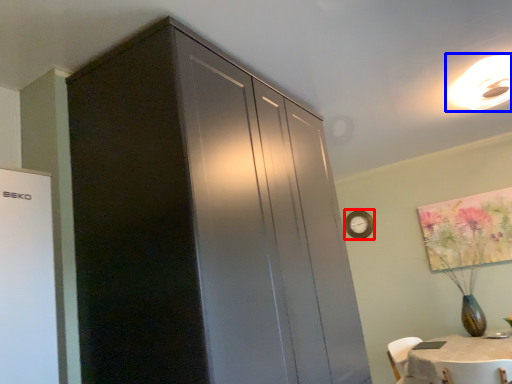
Question: Which object appears farthest to the camera in this image, clock (highlighted by a red box) or light fixture (highlighted by a blue box)?

Choices:
 (A) clock
 (B) light fixture

Answer: (A)